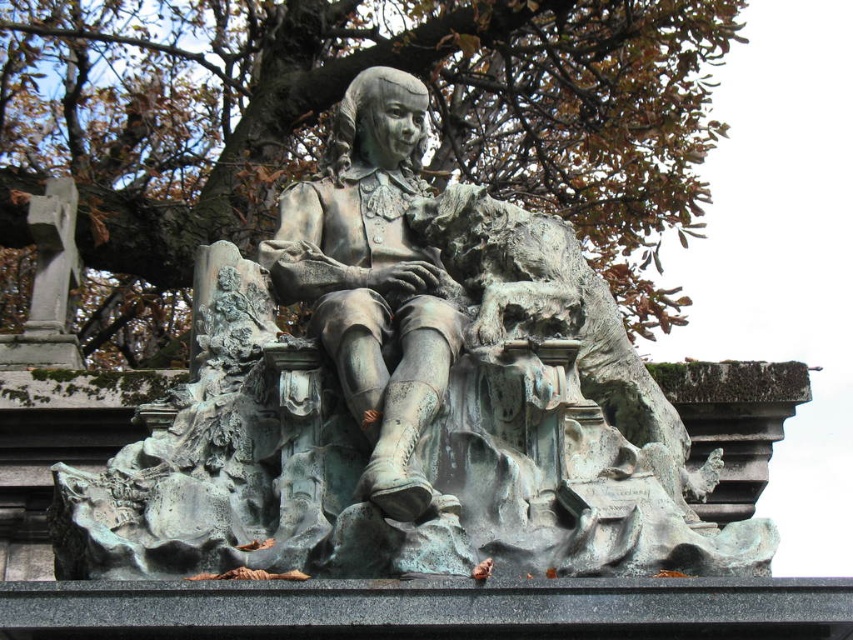
Is the position of brown textured tree at upper center less distant than that of bronze statue at center?

No, it is behind bronze statue at center.

Which of these two, brown textured tree at upper center or bronze statue at center, stands shorter?

bronze statue at center

Describe the element at coordinates (328, 125) in the screenshot. The height and width of the screenshot is (640, 853). I see `brown textured tree at upper center` at that location.

Identify the location of brown textured tree at upper center. (328, 125).

Does green patina statue at center have a larger size compared to bronze statue at center?

Yes.

Is point (405, 307) behind point (387, 80)?

No, it is not.

I want to click on green patina statue at center, so click(x=403, y=397).

Find the location of a particular element. The width and height of the screenshot is (853, 640). green patina statue at center is located at coordinates (403, 397).

Is green patina statue at center further to camera compared to brown textured tree at upper center?

No, it is not.

Locate an element on the screen. The width and height of the screenshot is (853, 640). green patina statue at center is located at coordinates (403, 397).